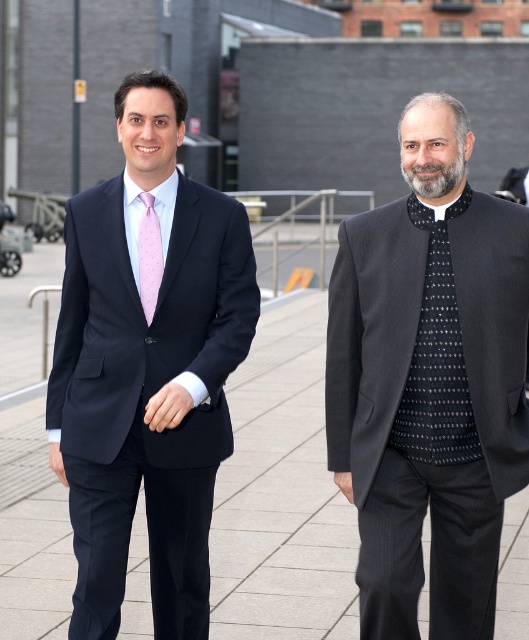
Question: Which object is closer to the camera taking this photo?

Choices:
 (A) dark gray textured suit at center
 (B) matte pink silk tie at left
 (C) paved concrete at center

Answer: (A)

Question: Can you confirm if gray/bearded man at center is thinner than matte pink silk tie at left?

Choices:
 (A) yes
 (B) no

Answer: (B)

Question: Can you confirm if matte black suit at left is thinner than paved concrete at center?

Choices:
 (A) no
 (B) yes

Answer: (B)

Question: Among these objects, which one is nearest to the camera?

Choices:
 (A) dark gray textured suit at center
 (B) gray/bearded man at center
 (C) matte black suit at left
 (D) paved concrete at center

Answer: (B)

Question: Can you confirm if paved concrete at center is bigger than matte pink silk tie at left?

Choices:
 (A) no
 (B) yes

Answer: (B)

Question: Among these objects, which one is farthest from the camera?

Choices:
 (A) gray/bearded man at center
 (B) matte black suit at left
 (C) dark gray textured suit at center

Answer: (B)